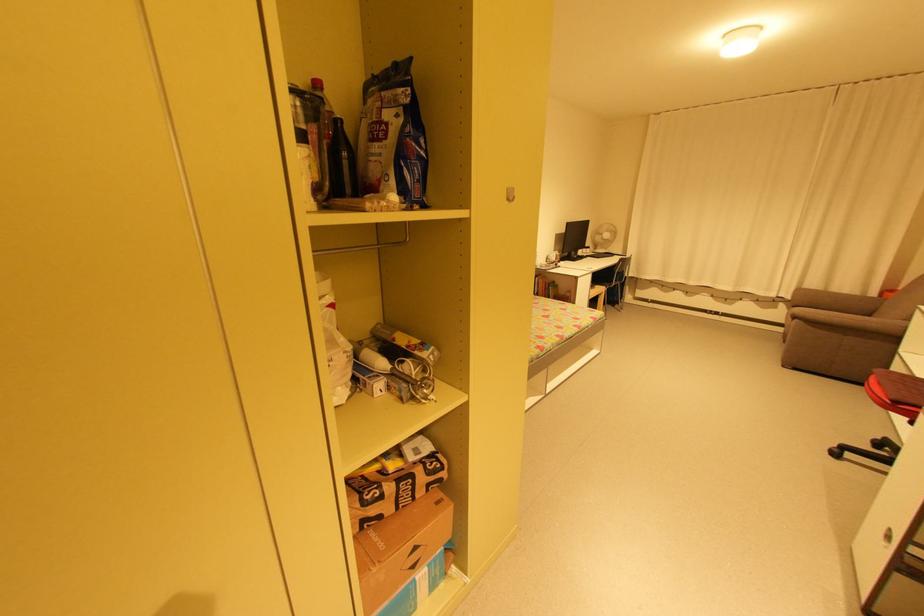
Locate an element on the screen. The width and height of the screenshot is (924, 616). red chair sitting surface is located at coordinates pos(845,331).